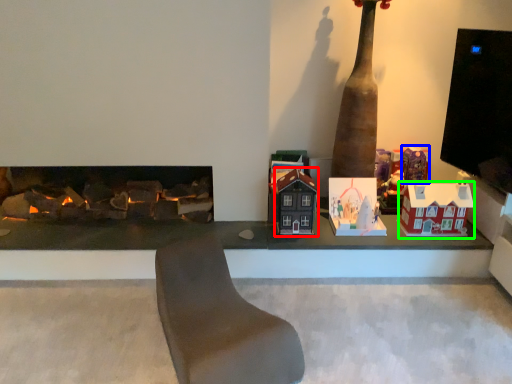
Question: Which object is positioned closest to toy (highlighted by a red box)? Select from toy (highlighted by a blue box) and toy (highlighted by a green box).

Choices:
 (A) toy
 (B) toy

Answer: (B)